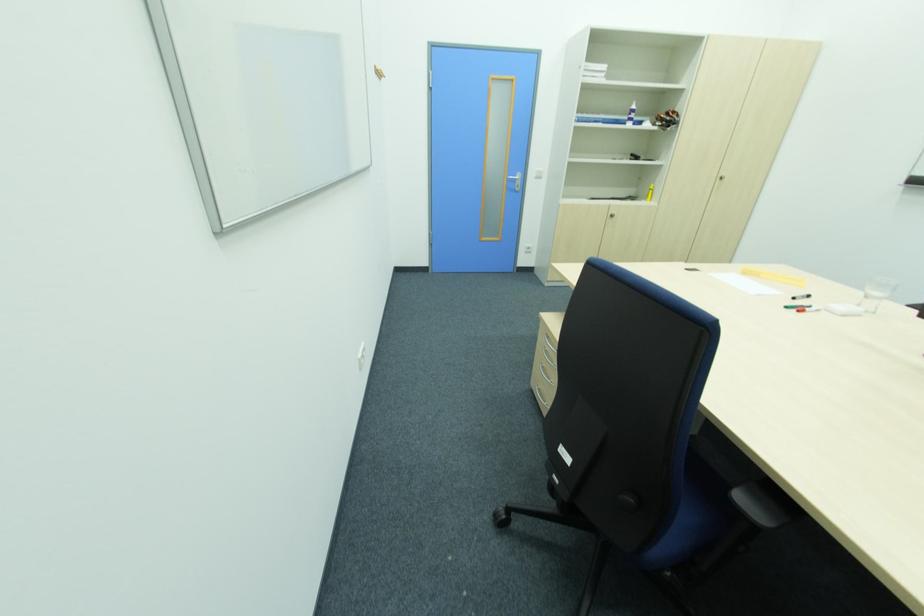
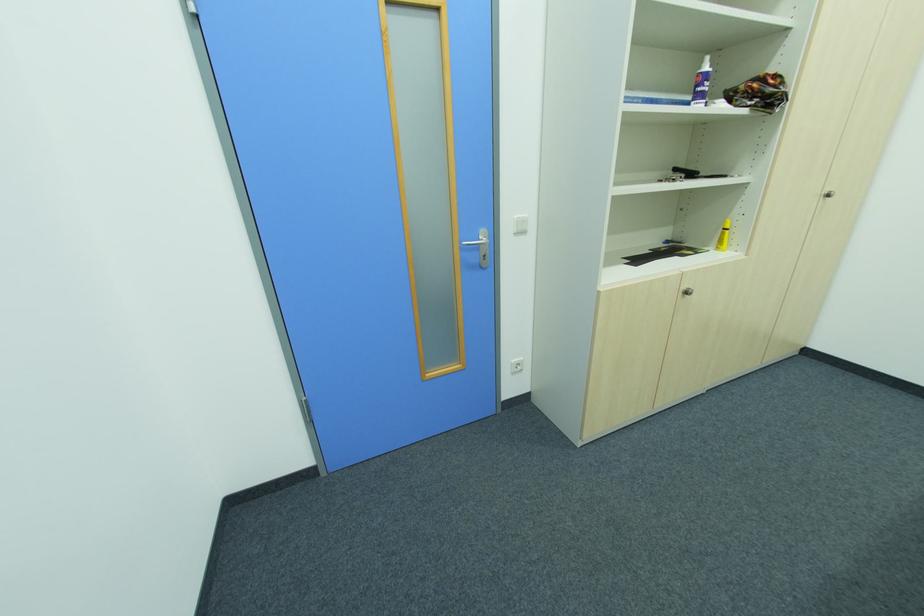
Locate, in the second image, the point that corresponds to point (541, 177) in the first image.

(525, 233)